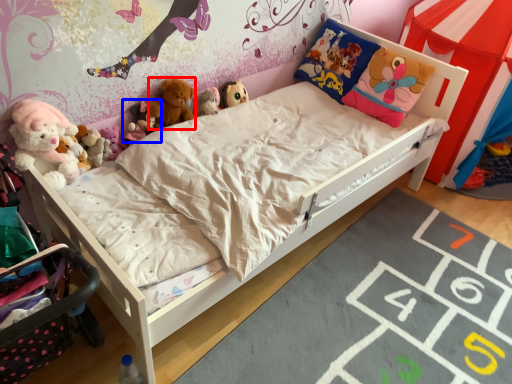
Question: Which object is further to the camera taking this photo, toy (highlighted by a red box) or toy (highlighted by a blue box)?

Choices:
 (A) toy
 (B) toy

Answer: (A)